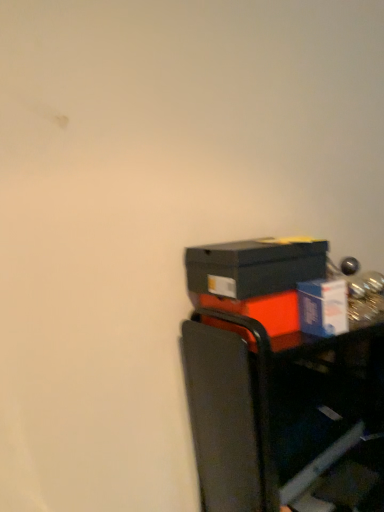
Question: Can metallic black cart at lower right be found inside orange matte box at right, which appears as the first box when ordered from the bottom?

Choices:
 (A) yes
 (B) no

Answer: (B)

Question: From the image's perspective, is orange matte box at right, which appears as the 3th box when viewed from the top, on metallic black cart at lower right?

Choices:
 (A) yes
 (B) no

Answer: (A)

Question: Is orange matte box at right, which appears as the 3th box when viewed from the top, positioned with its back to metallic black cart at lower right?

Choices:
 (A) yes
 (B) no

Answer: (B)

Question: Does orange matte box at right, which appears as the 3th box when viewed from the top, have a lesser width compared to metallic black cart at lower right?

Choices:
 (A) yes
 (B) no

Answer: (B)

Question: Considering the relative positions of orange matte box at right, which appears as the first box when ordered from the bottom, and metallic black cart at lower right in the image provided, is orange matte box at right, which appears as the first box when ordered from the bottom, behind metallic black cart at lower right?

Choices:
 (A) no
 (B) yes

Answer: (B)

Question: From the image's perspective, would you say orange matte box at right, which appears as the 3th box when viewed from the top, is shown under metallic black cart at lower right?

Choices:
 (A) yes
 (B) no

Answer: (B)

Question: Is metallic black cart at lower right positioned in front of orange matte box at right, which appears as the first box when ordered from the bottom?

Choices:
 (A) no
 (B) yes

Answer: (B)

Question: Could you tell me if metallic black cart at lower right is turned towards orange matte box at right, which appears as the 3th box when viewed from the top?

Choices:
 (A) no
 (B) yes

Answer: (A)

Question: Is orange matte box at right, which appears as the first box when ordered from the bottom, surrounded by metallic black cart at lower right?

Choices:
 (A) no
 (B) yes

Answer: (A)

Question: From the image's perspective, is metallic black cart at lower right located above orange matte box at right, which appears as the first box when ordered from the bottom?

Choices:
 (A) yes
 (B) no

Answer: (B)

Question: Is metallic black cart at lower right positioned beyond the bounds of orange matte box at right, which appears as the 3th box when viewed from the top?

Choices:
 (A) no
 (B) yes

Answer: (B)

Question: Is there a large distance between metallic black cart at lower right and orange matte box at right, which appears as the first box when ordered from the bottom?

Choices:
 (A) yes
 (B) no

Answer: (B)

Question: Considering the relative sizes of blue cardboard box at right, which is counted as the 2th box, starting from the top, and metallic black cart at lower right in the image provided, is blue cardboard box at right, which is counted as the 2th box, starting from the top, bigger than metallic black cart at lower right?

Choices:
 (A) yes
 (B) no

Answer: (B)